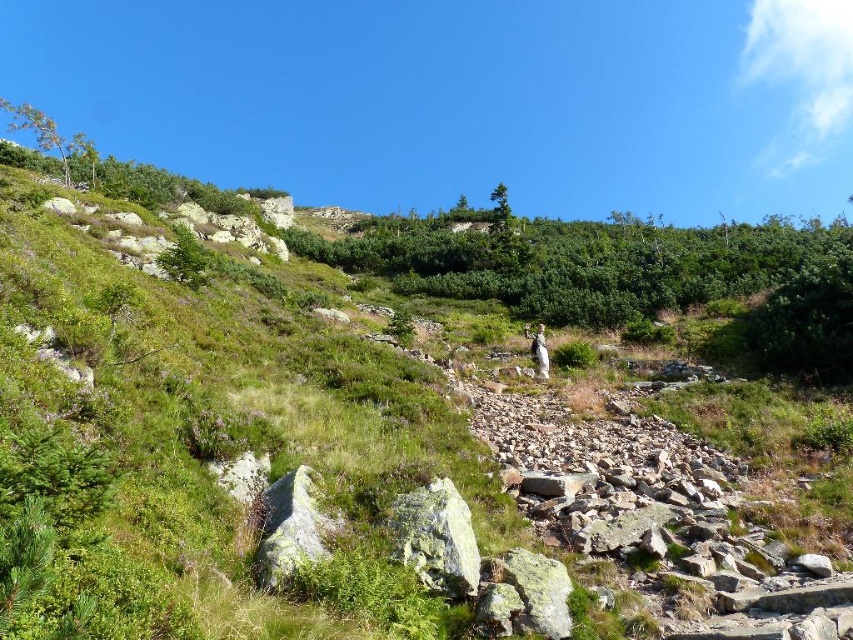
Can you confirm if white speckled rock at center is wider than gray/rough rock at center?

Indeed, white speckled rock at center has a greater width compared to gray/rough rock at center.

Can you confirm if white speckled rock at center is positioned to the left of gray/rough rock at center?

No, white speckled rock at center is not to the left of gray/rough rock at center.

Describe the element at coordinates (436, 538) in the screenshot. I see `white speckled rock at center` at that location.

Find the location of a particular element. The width and height of the screenshot is (853, 640). white speckled rock at center is located at coordinates (436, 538).

Does white speckled rock at center appear on the right side of white woolen sweater at center?

In fact, white speckled rock at center is to the left of white woolen sweater at center.

Between white speckled rock at center and white woolen sweater at center, which one appears on the left side from the viewer's perspective?

white speckled rock at center is more to the left.

Which is behind, point (409, 563) or point (544, 355)?

Positioned behind is point (544, 355).

Identify the location of white speckled rock at center. This screenshot has height=640, width=853. (436, 538).

Can you confirm if gray/rough rock at center is wider than white woolen sweater at center?

Correct, the width of gray/rough rock at center exceeds that of white woolen sweater at center.

Who is higher up, gray/rough rock at center or white woolen sweater at center?

white woolen sweater at center is higher up.

Describe the element at coordinates (291, 528) in the screenshot. I see `gray/rough rock at center` at that location.

Identify the location of gray/rough rock at center. (291, 528).